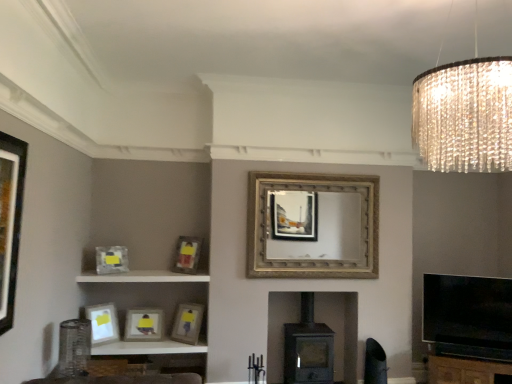
Find the location of `empty space that is ontop of matte wooden picture frame at lower center, placed as the seventh picture frame when sorted from front to back (from a real-world perspective)`. empty space that is ontop of matte wooden picture frame at lower center, placed as the seventh picture frame when sorted from front to back (from a real-world perspective) is located at coordinates (147, 306).